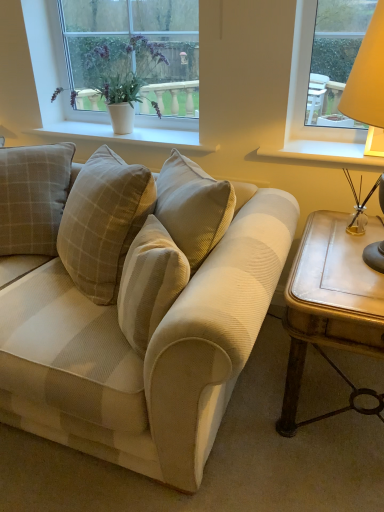
The height and width of the screenshot is (512, 384). I want to click on vacant region above white textured pot at upper center, which is counted as the second window sill, starting from the right (from a real-world perspective), so click(110, 128).